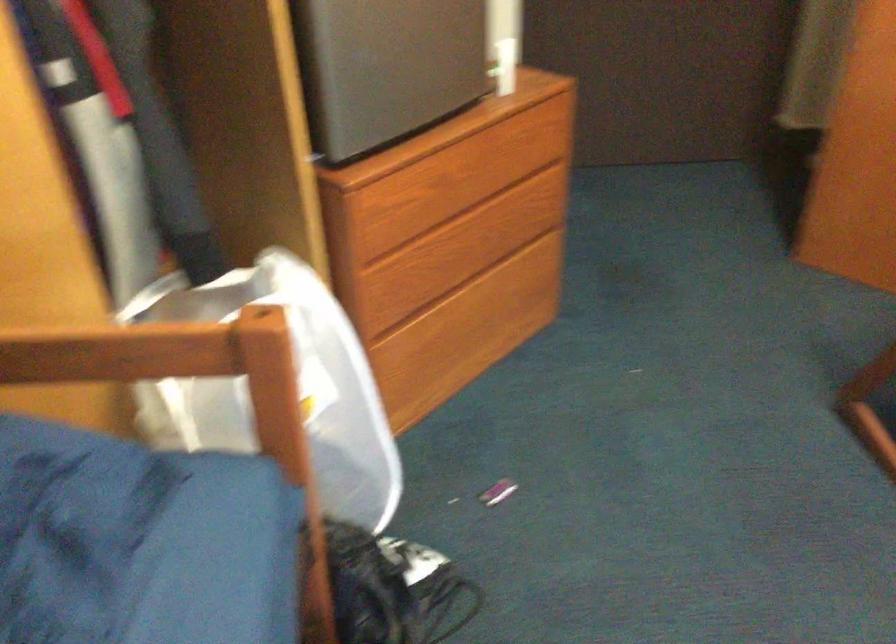
This screenshot has width=896, height=644. I want to click on white plastic bag, so click(297, 386).